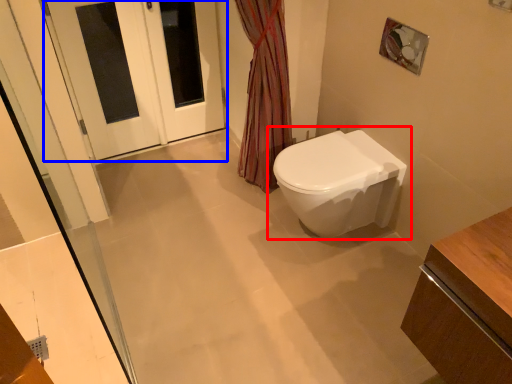
Question: Among these objects, which one is nearest to the camera, toilet (highlighted by a red box) or door (highlighted by a blue box)?

Choices:
 (A) toilet
 (B) door

Answer: (A)